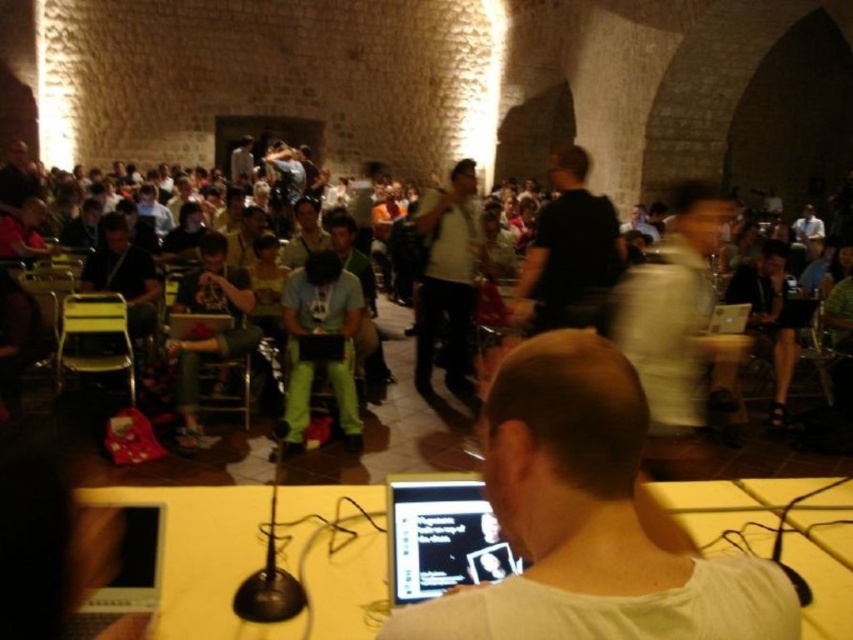
Question: Can you confirm if black matte shirt at center is bigger than green fabric chairs at center?

Choices:
 (A) no
 (B) yes

Answer: (A)

Question: Which point is farther from the camera taking this photo?

Choices:
 (A) (419, 332)
 (B) (692, 428)

Answer: (A)

Question: Which point is closer to the camera?

Choices:
 (A) light brown leather jacket at center
 (B) white plastic table at center
 (C) white matte shirt at center

Answer: (C)

Question: Does white matte shirt at center appear over white plastic table at center?

Choices:
 (A) no
 (B) yes

Answer: (B)

Question: Is black glossy laptop at lower center wider than light gray cotton shirt at center?

Choices:
 (A) yes
 (B) no

Answer: (B)

Question: Which of these objects is positioned closest to the light brown leather jacket at center?

Choices:
 (A) black glossy laptop at lower center
 (B) white plastic table at center
 (C) white matte shirt at center

Answer: (B)